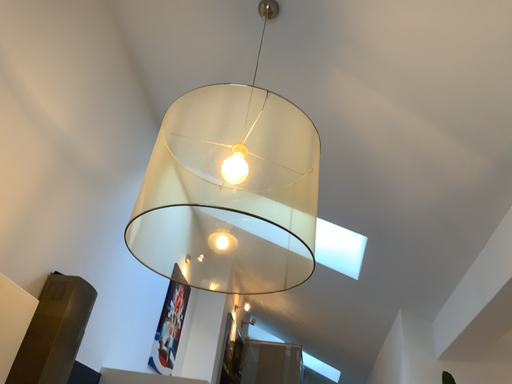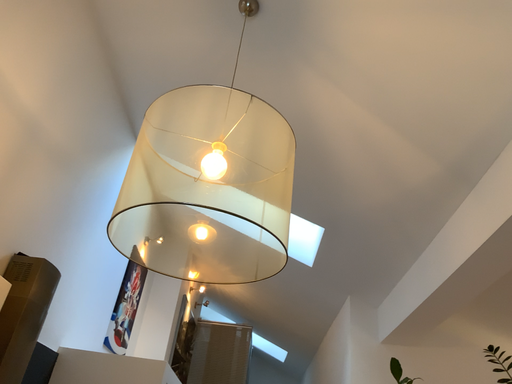
Question: Which way did the camera rotate in the video?

Choices:
 (A) rotated right
 (B) rotated left

Answer: (A)